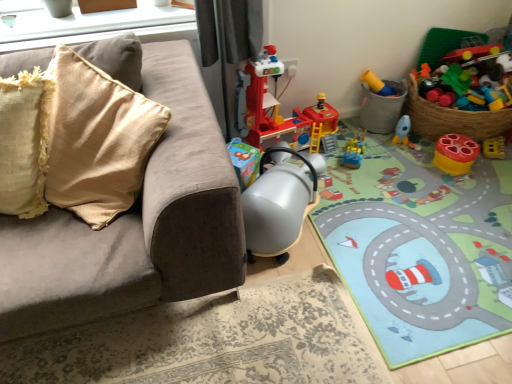
The image size is (512, 384). What do you see at coordinates (419, 246) in the screenshot?
I see `carpeted play mat at center` at bounding box center [419, 246].

Locate an element on the screen. translucent plastic train at center, the fifth toy from the right is located at coordinates (354, 151).

Describe the element at coordinates (404, 133) in the screenshot. The height and width of the screenshot is (384, 512). I see `matte plastic rocket at lower right, which appears as the 3th toy when viewed from the right` at that location.

The height and width of the screenshot is (384, 512). I want to click on plastic yellow toy at upper right, which is the third toy in left-to-right order, so click(x=381, y=103).

The height and width of the screenshot is (384, 512). What do you see at coordinates (381, 103) in the screenshot? I see `plastic yellow toy at upper right, which is the third toy in left-to-right order` at bounding box center [381, 103].

What do you see at coordinates (469, 79) in the screenshot?
I see `translucent plastic toy at upper right, which is the 1th toy from right to left` at bounding box center [469, 79].

Identify the location of matte plastic toy at right, marked as the second toy in a right-to-left arrangement. This screenshot has height=384, width=512. (455, 154).

Does translucent plastic train at center, positioned as the second toy in left-to-right order, have a greater width compared to matte plastic toy at right, marked as the second toy in a right-to-left arrangement?

Indeed, translucent plastic train at center, positioned as the second toy in left-to-right order, has a greater width compared to matte plastic toy at right, marked as the second toy in a right-to-left arrangement.

From the image's perspective, which object appears higher, translucent plastic train at center, the fifth toy from the right, or matte plastic toy at right, the 5th toy in the left-to-right sequence?

translucent plastic train at center, the fifth toy from the right, from the image's perspective.

Based on the photo, who is smaller, translucent plastic train at center, the fifth toy from the right, or matte plastic toy at right, the 5th toy in the left-to-right sequence?

translucent plastic train at center, the fifth toy from the right, is smaller.

Between plastic yellow toy at upper right, which ranks as the fourth toy in right-to-left order, and translucent plastic toy at upper right, which is the sixth toy in left-to-right order, which one is positioned behind?

plastic yellow toy at upper right, which ranks as the fourth toy in right-to-left order, is more distant.

Is plastic yellow toy at upper right, which is the third toy in left-to-right order, not within translucent plastic toy at upper right, which is the 1th toy from right to left?

Indeed, plastic yellow toy at upper right, which is the third toy in left-to-right order, is completely outside translucent plastic toy at upper right, which is the 1th toy from right to left.

Looking at this image, from the image's perspective, is plastic yellow toy at upper right, which ranks as the fourth toy in right-to-left order, above or below translucent plastic toy at upper right, which is the 1th toy from right to left?

Based on their image positions, plastic yellow toy at upper right, which ranks as the fourth toy in right-to-left order, is located beneath translucent plastic toy at upper right, which is the 1th toy from right to left.

From a real-world perspective, relative to translucent plastic toy at upper right, which is the sixth toy in left-to-right order, is plastic yellow toy at upper right, which ranks as the fourth toy in right-to-left order, vertically above or below?

plastic yellow toy at upper right, which ranks as the fourth toy in right-to-left order, is situated lower than translucent plastic toy at upper right, which is the sixth toy in left-to-right order, in the real world.

Considering the sizes of red plastic construction set at center, the first toy positioned from the left, and matte beige couch at left in the image, is red plastic construction set at center, the first toy positioned from the left, taller or shorter than matte beige couch at left?

In the image, red plastic construction set at center, the first toy positioned from the left, appears to be taller than matte beige couch at left.

Which point is more forward, (294, 128) or (212, 289)?

The point (212, 289) is in front.

Considering the sizes of red plastic construction set at center, which is counted as the 6th toy, starting from the right, and matte beige couch at left in the image, is red plastic construction set at center, which is counted as the 6th toy, starting from the right, wider or thinner than matte beige couch at left?

Clearly, red plastic construction set at center, which is counted as the 6th toy, starting from the right, has less width compared to matte beige couch at left.

Is red plastic construction set at center, which is counted as the 6th toy, starting from the right, smaller than matte beige couch at left?

Yes, red plastic construction set at center, which is counted as the 6th toy, starting from the right, is smaller than matte beige couch at left.

From the image's perspective, which is above, translucent plastic toy at upper right, which is the sixth toy in left-to-right order, or plastic yellow toy at upper right, which is the third toy in left-to-right order?

translucent plastic toy at upper right, which is the sixth toy in left-to-right order, appears higher in the image.

Who is shorter, translucent plastic toy at upper right, which is the sixth toy in left-to-right order, or plastic yellow toy at upper right, which is the third toy in left-to-right order?

With less height is plastic yellow toy at upper right, which is the third toy in left-to-right order.

Based on the photo, would you say translucent plastic toy at upper right, which is the 1th toy from right to left, contains plastic yellow toy at upper right, which is the third toy in left-to-right order?

Actually, plastic yellow toy at upper right, which is the third toy in left-to-right order, is outside translucent plastic toy at upper right, which is the 1th toy from right to left.

From a real-world perspective, is translucent plastic toy at upper right, which is the 1th toy from right to left, physically located above or below plastic yellow toy at upper right, which ranks as the fourth toy in right-to-left order?

From a real-world perspective, translucent plastic toy at upper right, which is the 1th toy from right to left, is physically above plastic yellow toy at upper right, which ranks as the fourth toy in right-to-left order.

Could you tell me if plastic yellow toy at upper right, which is the third toy in left-to-right order, is facing carpeted play mat at center?

Yes.

Considering the positions of objects plastic yellow toy at upper right, which ranks as the fourth toy in right-to-left order, and carpeted play mat at center in the image provided, who is in front, plastic yellow toy at upper right, which ranks as the fourth toy in right-to-left order, or carpeted play mat at center?

carpeted play mat at center is closer to the camera.

How much distance is there between plastic yellow toy at upper right, which ranks as the fourth toy in right-to-left order, and carpeted play mat at center?

They are 23.60 inches apart.

From a real-world perspective, is plastic yellow toy at upper right, which is the third toy in left-to-right order, over carpeted play mat at center?

Yes, from a real-world perspective, plastic yellow toy at upper right, which is the third toy in left-to-right order, is above carpeted play mat at center.

Who is shorter, matte beige couch at left or matte plastic toy at right, marked as the second toy in a right-to-left arrangement?

With less height is matte plastic toy at right, marked as the second toy in a right-to-left arrangement.

Is there a large distance between matte beige couch at left and matte plastic toy at right, marked as the second toy in a right-to-left arrangement?

Yes, matte beige couch at left and matte plastic toy at right, marked as the second toy in a right-to-left arrangement, are quite far apart.

Considering the relative sizes of matte beige couch at left and matte plastic toy at right, the 5th toy in the left-to-right sequence, in the image provided, is matte beige couch at left thinner than matte plastic toy at right, the 5th toy in the left-to-right sequence,?

Incorrect, the width of matte beige couch at left is not less than that of matte plastic toy at right, the 5th toy in the left-to-right sequence.

Is matte beige couch at left positioned with its back to matte plastic toy at right, the 5th toy in the left-to-right sequence?

No, matte plastic toy at right, the 5th toy in the left-to-right sequence, is not at the back of matte beige couch at left.

Would you say plastic yellow toy at upper right, which ranks as the fourth toy in right-to-left order, is inside or outside matte plastic rocket at lower right, which appears as the 3th toy when viewed from the right?

plastic yellow toy at upper right, which ranks as the fourth toy in right-to-left order, is located beyond the bounds of matte plastic rocket at lower right, which appears as the 3th toy when viewed from the right.

Is plastic yellow toy at upper right, which ranks as the fourth toy in right-to-left order, directly adjacent to matte plastic rocket at lower right, which appears as the 3th toy when viewed from the right?

No, plastic yellow toy at upper right, which ranks as the fourth toy in right-to-left order, is not in contact with matte plastic rocket at lower right, which appears as the 3th toy when viewed from the right.

Does point (368, 115) appear closer or farther from the camera than point (397, 134)?

Point (368, 115).

Considering the relative sizes of plastic yellow toy at upper right, which ranks as the fourth toy in right-to-left order, and matte plastic rocket at lower right, the fourth toy positioned from the left, in the image provided, is plastic yellow toy at upper right, which ranks as the fourth toy in right-to-left order, wider than matte plastic rocket at lower right, the fourth toy positioned from the left,?

Indeed, plastic yellow toy at upper right, which ranks as the fourth toy in right-to-left order, has a greater width compared to matte plastic rocket at lower right, the fourth toy positioned from the left.

From a real-world perspective, count 1st toys upward from the translucent plastic train at center, positioned as the second toy in left-to-right order, and point to it. Please provide its 2D coordinates.

[(455, 154)]

The image size is (512, 384). What are the coordinates of `toy above the plastic yellow toy at upper right, which ranks as the fourth toy in right-to-left order (from the image's perspective)` in the screenshot? It's located at (469, 79).

When comparing their distances from matte beige couch at left, does matte plastic rocket at lower right, which appears as the 3th toy when viewed from the right, or plastic yellow toy at upper right, which is the third toy in left-to-right order, seem further?

matte plastic rocket at lower right, which appears as the 3th toy when viewed from the right.

Based on their spatial positions, is plastic yellow toy at upper right, which is the third toy in left-to-right order, or matte plastic toy at right, marked as the second toy in a right-to-left arrangement, closer to red plastic construction set at center, which is counted as the 6th toy, starting from the right?

plastic yellow toy at upper right, which is the third toy in left-to-right order, is closer to red plastic construction set at center, which is counted as the 6th toy, starting from the right.

Which object lies nearer to the anchor point matte beige couch at left, matte plastic toy at right, marked as the second toy in a right-to-left arrangement, or matte plastic rocket at lower right, the fourth toy positioned from the left?

matte plastic toy at right, marked as the second toy in a right-to-left arrangement, is closer to matte beige couch at left.

Considering their positions, is carpeted play mat at center positioned closer to matte beige couch at left than plastic yellow toy at upper right, which ranks as the fourth toy in right-to-left order?

carpeted play mat at center is positioned closer to the anchor matte beige couch at left.

From the image, which object appears to be farther from matte plastic rocket at lower right, which appears as the 3th toy when viewed from the right, translucent plastic toy at upper right, which is the sixth toy in left-to-right order, or matte plastic toy at right, marked as the second toy in a right-to-left arrangement?

translucent plastic toy at upper right, which is the sixth toy in left-to-right order, is positioned further to the anchor matte plastic rocket at lower right, which appears as the 3th toy when viewed from the right.

When comparing their distances from matte plastic toy at right, the 5th toy in the left-to-right sequence, does translucent plastic toy at upper right, which is the 1th toy from right to left, or red plastic construction set at center, the first toy positioned from the left, seem closer?

The object closer to matte plastic toy at right, the 5th toy in the left-to-right sequence, is translucent plastic toy at upper right, which is the 1th toy from right to left.

Which object lies nearer to the anchor point translucent plastic toy at upper right, which is the sixth toy in left-to-right order, translucent plastic train at center, the fifth toy from the right, or matte plastic toy at right, the 5th toy in the left-to-right sequence?

Among the two, matte plastic toy at right, the 5th toy in the left-to-right sequence, is located nearer to translucent plastic toy at upper right, which is the sixth toy in left-to-right order.

Based on their spatial positions, is plastic yellow toy at upper right, which is the third toy in left-to-right order, or translucent plastic train at center, the fifth toy from the right, closer to translucent plastic toy at upper right, which is the 1th toy from right to left?

Among the two, plastic yellow toy at upper right, which is the third toy in left-to-right order, is located nearer to translucent plastic toy at upper right, which is the 1th toy from right to left.

Where is `toy between plastic yellow toy at upper right, which ranks as the fourth toy in right-to-left order, and matte plastic toy at right, marked as the second toy in a right-to-left arrangement, in the horizontal direction`? The height and width of the screenshot is (384, 512). toy between plastic yellow toy at upper right, which ranks as the fourth toy in right-to-left order, and matte plastic toy at right, marked as the second toy in a right-to-left arrangement, in the horizontal direction is located at coordinates (404, 133).

Identify the location of mat situated between red plastic construction set at center, the first toy positioned from the left, and translucent plastic toy at upper right, which is the 1th toy from right to left, from left to right. The width and height of the screenshot is (512, 384). (419, 246).

Where is `toy located between red plastic construction set at center, the first toy positioned from the left, and plastic yellow toy at upper right, which is the third toy in left-to-right order, in the left-right direction`? The width and height of the screenshot is (512, 384). toy located between red plastic construction set at center, the first toy positioned from the left, and plastic yellow toy at upper right, which is the third toy in left-to-right order, in the left-right direction is located at coordinates (354, 151).

I want to click on mat situated between matte beige couch at left and matte plastic toy at right, the 5th toy in the left-to-right sequence, from left to right, so click(419, 246).